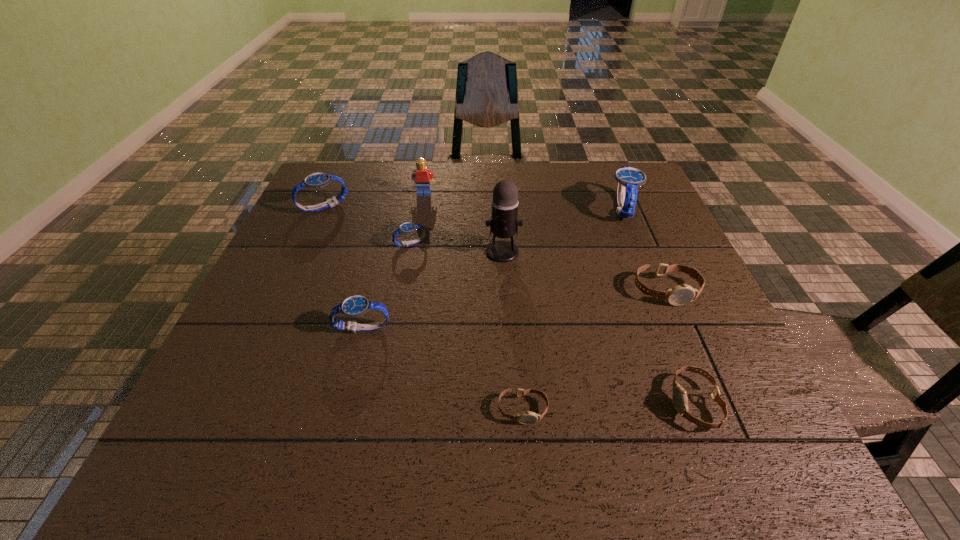
Where is `microphone`? microphone is located at coordinates (503, 224).

Find the location of `the tallest object`. the tallest object is located at coordinates (503, 224).

You are a GUI agent. You are given a task and a screenshot of the screen. Output one action in this format:
    pyautogui.click(x=<x>, y=<y>)
    Task: Click on the Lego
    
    Given the screenshot: What is the action you would take?
    pyautogui.click(x=422, y=175)

Image resolution: width=960 pixels, height=540 pixels. I want to click on the biggest blue watch, so click(629, 179).

At what (x,y) coordinates should I click in order to perform the action: click on the rightmost blue watch. Please return your answer as a coordinate pair (x, y). Looking at the image, I should click on (629, 179).

This screenshot has height=540, width=960. Identify the location of the leftmost object. (316, 180).

In order to click on the second biggest blue watch in this screenshot , I will do `click(316, 180)`.

Locate an element on the screen. The image size is (960, 540). the second smallest blue watch is located at coordinates 354,306.

The height and width of the screenshot is (540, 960). I want to click on the nearest blue watch, so click(354, 306).

The width and height of the screenshot is (960, 540). In order to click on the farthest beige watch in this screenshot , I will do `click(679, 295)`.